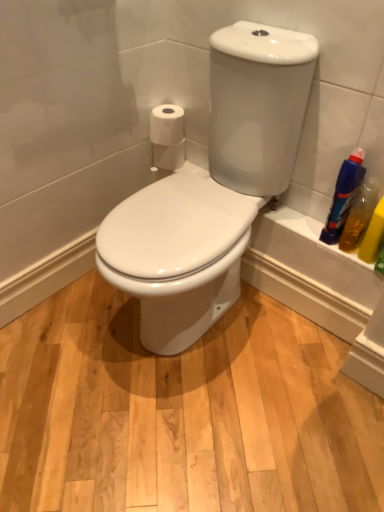
Question: Is white matte toilet paper at upper left, arranged as the second toilet paper when viewed from the top, at the back of white matte toilet paper at upper right, positioned as the 1th toilet paper in top-to-bottom order?

Choices:
 (A) yes
 (B) no

Answer: (B)

Question: Considering the relative sizes of white matte toilet paper at upper right, the second toilet paper positioned from the bottom, and white matte toilet paper at upper left, which ranks as the 1th toilet paper in bottom-to-top order, in the image provided, is white matte toilet paper at upper right, the second toilet paper positioned from the bottom, taller than white matte toilet paper at upper left, which ranks as the 1th toilet paper in bottom-to-top order,?

Choices:
 (A) yes
 (B) no

Answer: (A)

Question: Does white matte toilet paper at upper right, the second toilet paper positioned from the bottom, come behind white matte toilet paper at upper left, which ranks as the 1th toilet paper in bottom-to-top order?

Choices:
 (A) yes
 (B) no

Answer: (B)

Question: From the image's perspective, is white matte toilet paper at upper right, the second toilet paper positioned from the bottom, under white matte toilet paper at upper left, arranged as the second toilet paper when viewed from the top?

Choices:
 (A) yes
 (B) no

Answer: (B)

Question: Can you confirm if white matte toilet paper at upper right, positioned as the 1th toilet paper in top-to-bottom order, is shorter than white matte toilet paper at upper left, which ranks as the 1th toilet paper in bottom-to-top order?

Choices:
 (A) no
 (B) yes

Answer: (A)

Question: Considering the relative positions of white matte toilet paper at upper right, the second toilet paper positioned from the bottom, and white matte toilet paper at upper left, arranged as the second toilet paper when viewed from the top, in the image provided, is white matte toilet paper at upper right, the second toilet paper positioned from the bottom, to the left of white matte toilet paper at upper left, arranged as the second toilet paper when viewed from the top, from the viewer's perspective?

Choices:
 (A) no
 (B) yes

Answer: (A)

Question: Is white matte toilet paper at upper left, arranged as the second toilet paper when viewed from the top, taller than blue plastic bottle at right, placed as the first cleaning product when sorted from left to right?

Choices:
 (A) no
 (B) yes

Answer: (A)

Question: Is blue plastic bottle at right, placed as the first cleaning product when sorted from left to right, located within white matte toilet paper at upper left, which ranks as the 1th toilet paper in bottom-to-top order?

Choices:
 (A) yes
 (B) no

Answer: (B)

Question: Can you confirm if white matte toilet paper at upper left, which ranks as the 1th toilet paper in bottom-to-top order, is bigger than blue plastic bottle at right, the second cleaning product in the right-to-left sequence?

Choices:
 (A) no
 (B) yes

Answer: (A)

Question: Is white matte toilet paper at upper left, arranged as the second toilet paper when viewed from the top, smaller than blue plastic bottle at right, placed as the first cleaning product when sorted from left to right?

Choices:
 (A) no
 (B) yes

Answer: (B)

Question: Is white matte toilet paper at upper left, arranged as the second toilet paper when viewed from the top, positioned beyond the bounds of blue plastic bottle at right, the second cleaning product in the right-to-left sequence?

Choices:
 (A) no
 (B) yes

Answer: (B)

Question: From a real-world perspective, is white matte toilet paper at upper left, which ranks as the 1th toilet paper in bottom-to-top order, beneath blue plastic bottle at right, the second cleaning product in the right-to-left sequence?

Choices:
 (A) yes
 (B) no

Answer: (A)

Question: Can you confirm if white matte toilet paper at upper right, the second toilet paper positioned from the bottom, is shorter than yellow translucent bottle at right, which is counted as the 1th cleaning product, starting from the right?

Choices:
 (A) no
 (B) yes

Answer: (B)